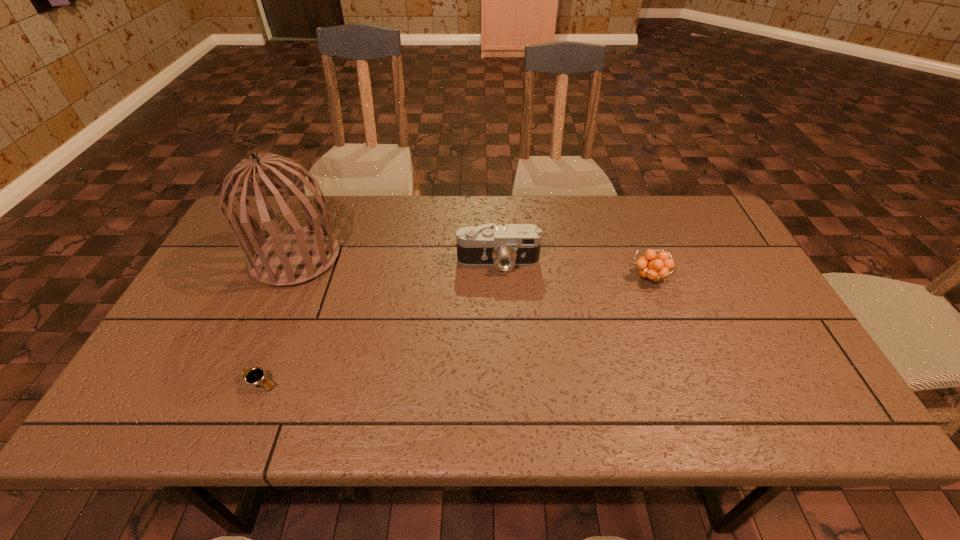
Select which object appears as the closest to the third object from left to right. Please provide its 2D coordinates. Your answer should be formatted as a tuple, i.e. [(x, y)], where the tuple contains the x and y coordinates of a point satisfying the conditions above.

[(652, 267)]

At what (x,y) coordinates should I click in order to perform the action: click on the second closest object relative to the nearest object. Please return your answer as a coordinate pair (x, y). Looking at the image, I should click on (504, 247).

Find the location of a particular element. The height and width of the screenshot is (540, 960). free spot that satisfies the following two spatial constraints: 1. on the front side of the birdcage; 2. on the left side of the orange fruit is located at coordinates click(288, 277).

The width and height of the screenshot is (960, 540). In order to click on vacant region that satisfies the following two spatial constraints: 1. on the back side of the watch; 2. on the left side of the rightmost object in this screenshot , I will do `click(302, 277)`.

The height and width of the screenshot is (540, 960). I want to click on free location that satisfies the following two spatial constraints: 1. on the lens of the rightmost object; 2. on the left side of the second object from right to left, so click(499, 277).

Find the location of a particular element. free spot that satisfies the following two spatial constraints: 1. on the lens of the rightmost object; 2. on the right side of the second object from right to left is located at coordinates (499, 277).